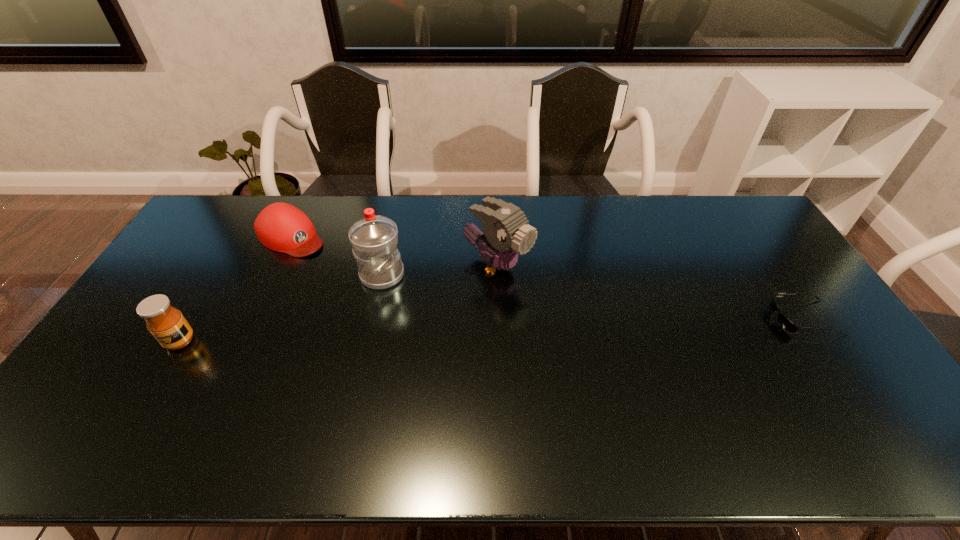
This screenshot has width=960, height=540. I want to click on vacant space situated 0.100m on the front-facing side of the sunglasses, so click(x=739, y=318).

The height and width of the screenshot is (540, 960). I want to click on free space located on the front-facing side of the sunglasses, so click(x=640, y=318).

Locate an element on the screen. This screenshot has width=960, height=540. vacant space located 0.390m on the handle side of the water bottle is located at coordinates (509, 333).

Find the location of a particular element. This screenshot has width=960, height=540. vacant space located on the handle side of the water bottle is located at coordinates (500, 328).

The image size is (960, 540). In order to click on vacant point located on the handle side of the water bottle in this screenshot , I will do `click(450, 306)`.

The height and width of the screenshot is (540, 960). What are the coordinates of `free spot located 0.400m on the front-facing side of the fourth tallest object` in the screenshot? It's located at (395, 305).

In order to click on free space located 0.090m on the front-facing side of the fourth tallest object in this screenshot , I will do `click(330, 261)`.

Identify the location of free region located 0.330m on the front-facing side of the fourth tallest object. This screenshot has height=540, width=960. (379, 294).

Locate an element on the screen. blank space located 0.160m at the beak of the fourth object from left to right is located at coordinates (564, 309).

The image size is (960, 540). What are the coordinates of `vacant space located at the beak of the fourth object from left to right` in the screenshot? It's located at (604, 335).